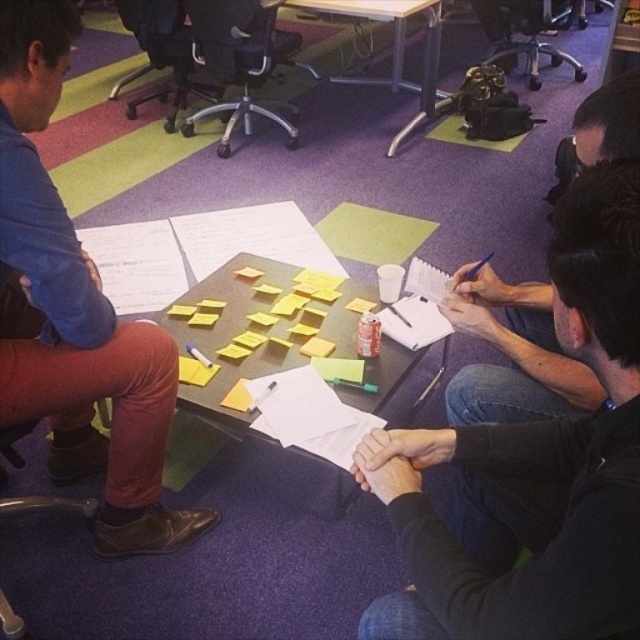
Question: Does black matte shirt at center appear under wooden table at center?

Choices:
 (A) yes
 (B) no

Answer: (A)

Question: Which object is the closest to the wooden table at center?

Choices:
 (A) matte blue shirt at left
 (B) yellow sticky notes at center

Answer: (B)

Question: Which point is farther from the camera taking this photo?

Choices:
 (A) (19, 42)
 (B) (436, 49)
 (C) (182, 321)
 (D) (588, 186)

Answer: (B)

Question: Which point appears closest to the camera in this image?

Choices:
 (A) (636, 497)
 (B) (184, 324)

Answer: (A)

Question: Is black matte shirt at center positioned at the back of wooden table at center?

Choices:
 (A) no
 (B) yes

Answer: (A)

Question: Does matte blue shirt at left appear over yellow sticky notes at center?

Choices:
 (A) no
 (B) yes

Answer: (B)